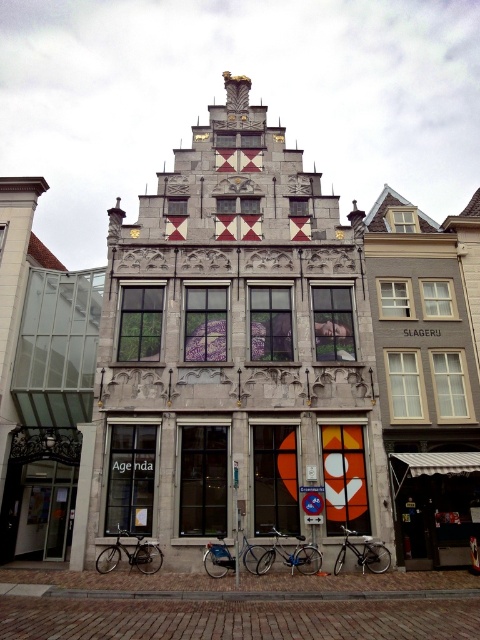
Question: Is blue metallic bicycle at lower center positioned in front of shiny metallic bicycle at lower center?

Choices:
 (A) no
 (B) yes

Answer: (B)

Question: In this image, where is silver metallic bicycle at lower left located relative to shiny metallic bicycle at center?

Choices:
 (A) left
 (B) right

Answer: (A)

Question: Is white canvas awning at lower right to the left of blue metallic bicycle at lower center from the viewer's perspective?

Choices:
 (A) no
 (B) yes

Answer: (A)

Question: Which of the following is the farthest from the observer?

Choices:
 (A) silver metallic bicycle at lower left
 (B) shiny metallic bicycle at lower center

Answer: (B)

Question: Which is nearer to the blue metallic bicycle at lower center?

Choices:
 (A) silver metallic bicycle at lower left
 (B) shiny metallic bicycle at lower center
 (C) white canvas awning at lower right
 (D) shiny metallic bicycle at center

Answer: (D)

Question: Which of the following is the farthest from the observer?

Choices:
 (A) blue metallic bicycle at lower center
 (B) shiny metallic bicycle at center
 (C) shiny metallic bicycle at lower center
 (D) silver metallic bicycle at lower left

Answer: (C)